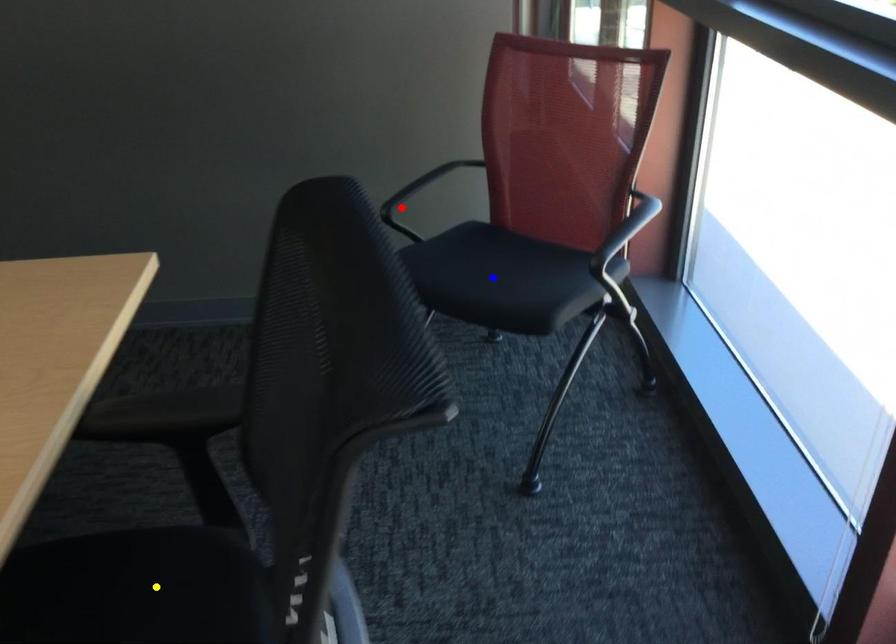
Order these from nearest to farthest:
red point, yellow point, blue point

yellow point, blue point, red point